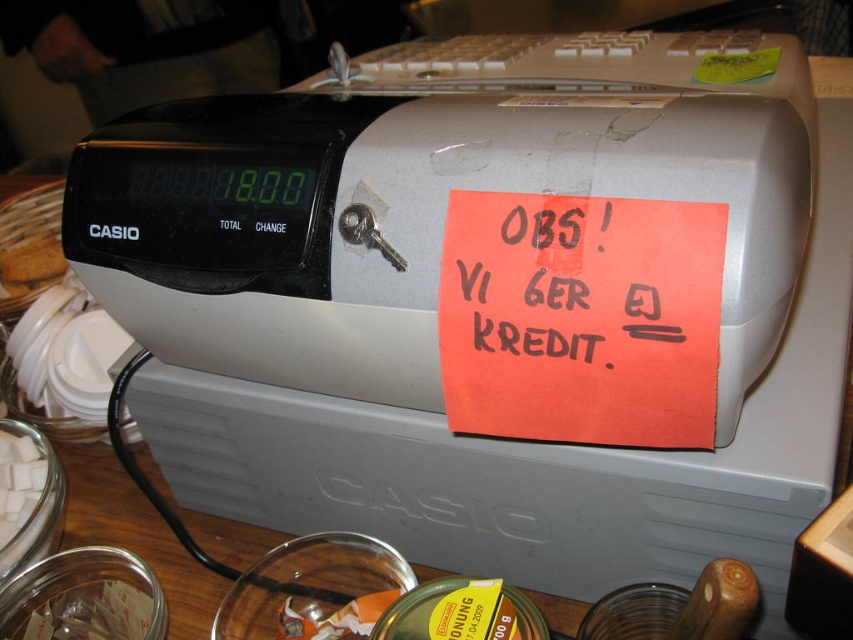
Is point (514, 256) in front of point (10, 250)?

Yes, point (514, 256) is in front of point (10, 250).

Does orange paper at center have a larger size compared to brown crumbly at left?

No, orange paper at center is not bigger than brown crumbly at left.

Does point (672, 244) come closer to viewer compared to point (25, 291)?

That is True.

You are a GUI agent. You are given a task and a screenshot of the screen. Output one action in this format:
    pyautogui.click(x=<x>, y=<y>)
    Task: Click on the orange paper at center
    
    Given the screenshot: What is the action you would take?
    pyautogui.click(x=563, y=282)

This screenshot has width=853, height=640. Describe the element at coordinates (563, 282) in the screenshot. I see `orange paper at center` at that location.

Is point (502, 339) positioned behind point (715, 76)?

No, it is not.

I want to click on orange paper at center, so click(563, 282).

Can you confirm if white sugar cubes at lower left is positioned to the left of brown crumbly at left?

Incorrect, white sugar cubes at lower left is not on the left side of brown crumbly at left.

Between white sugar cubes at lower left and brown crumbly at left, which one has more height?

Standing taller between the two is white sugar cubes at lower left.

The width and height of the screenshot is (853, 640). What do you see at coordinates (19, 486) in the screenshot?
I see `white sugar cubes at lower left` at bounding box center [19, 486].

Image resolution: width=853 pixels, height=640 pixels. What are the coordinates of `white sugar cubes at lower left` in the screenshot? It's located at point(19,486).